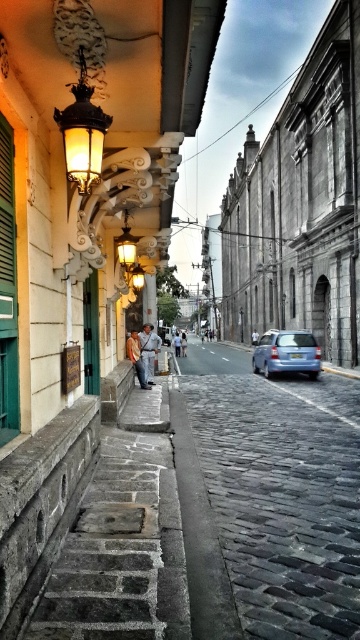
You are a delivery person who needs to place a denim jacket at center onto a blue matte car at center. Can you do this without moving the car?

The blue matte car at center is positioned under denim jacket at center, so you can place the denim jacket at center onto the blue matte car at center without moving the car.

You are standing on the cobblestone pavement at center and see a point marked at coordinates [267,508]. Is this point located on the cobblestone pavement or on the low stone wall along the left side of the street?

The point marked at coordinates [267,508] is located on the cobblestone pavement at center, not on the low stone wall along the left side of the street.

You are standing on the cobblestone pavement at center and looking up. Is the denim jacket at center above or below you?

The denim jacket at center is above you because the cobblestone pavement at center is located below denim jacket at center.